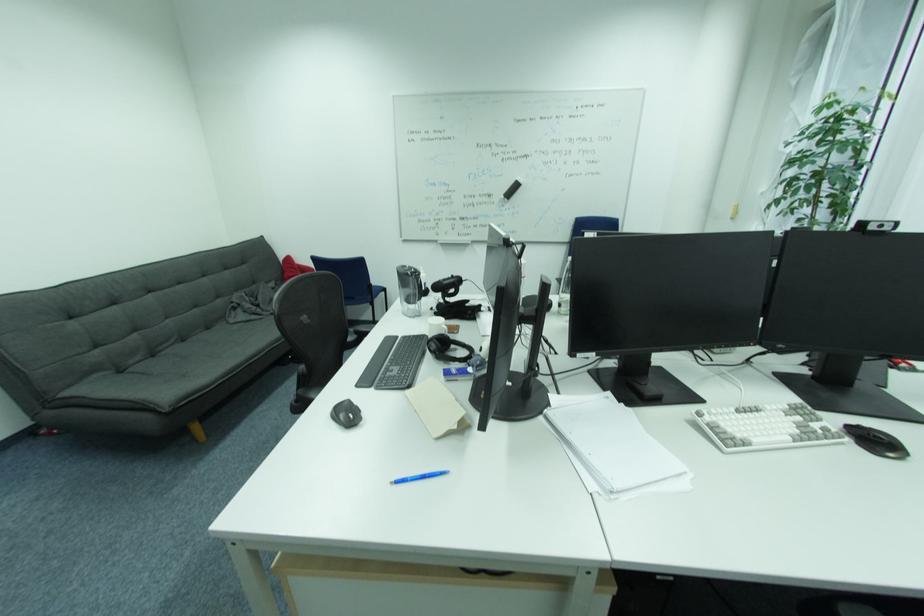
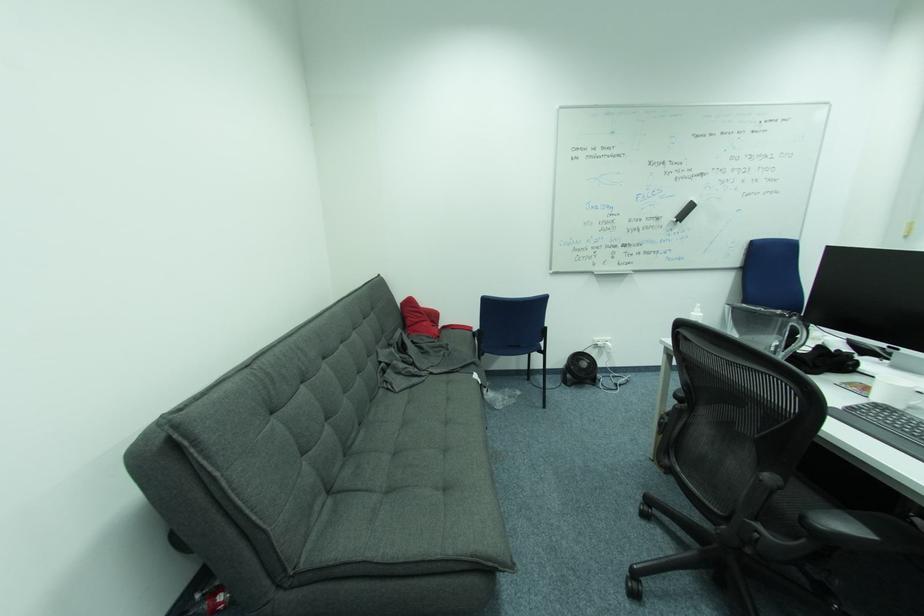
The images are taken continuously from a first-person perspective. In which direction are you moving?

The cameraman walked toward left, forward.